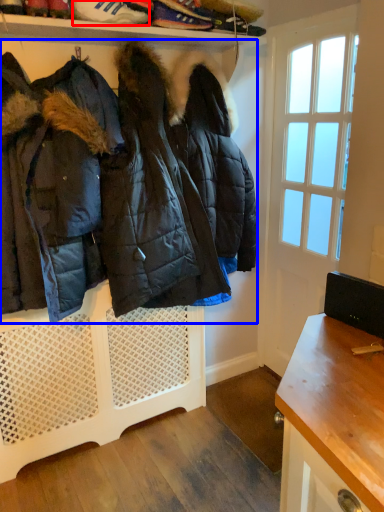
Question: Which object appears farthest to the camera in this image, footwear (highlighted by a red box) or jacket (highlighted by a blue box)?

Choices:
 (A) footwear
 (B) jacket

Answer: (A)